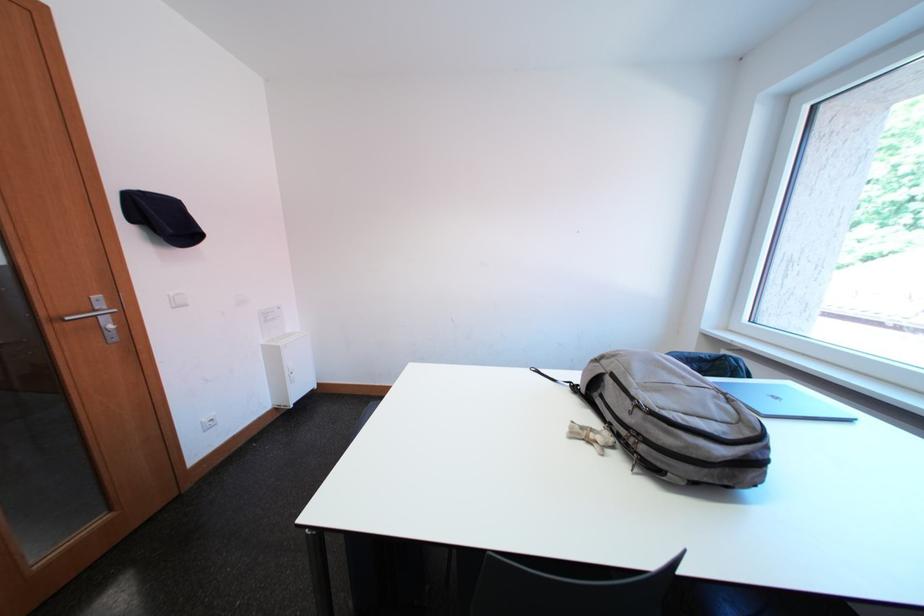
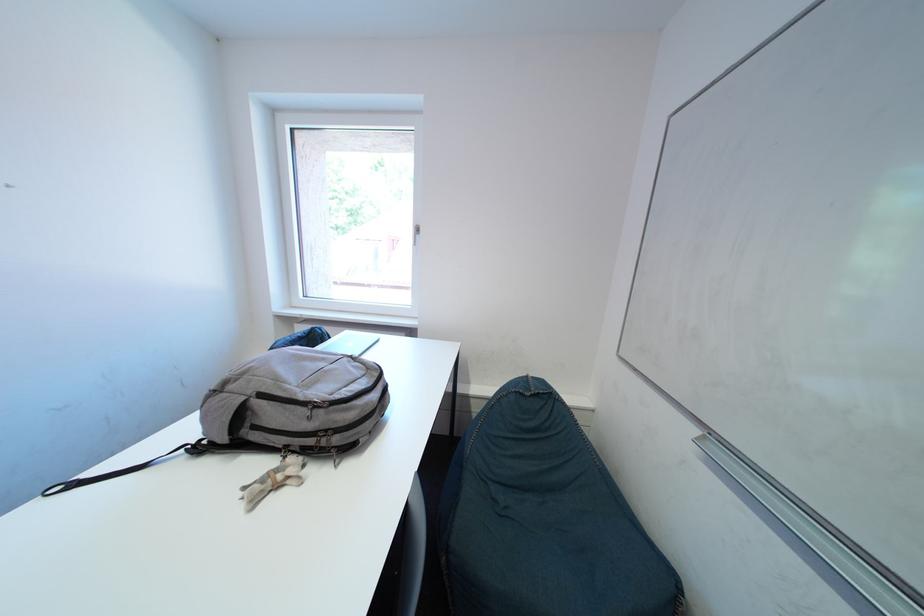
Question: How did the camera likely rotate?

Choices:
 (A) Left
 (B) Right
 (C) Up
 (D) Down

Answer: (B)